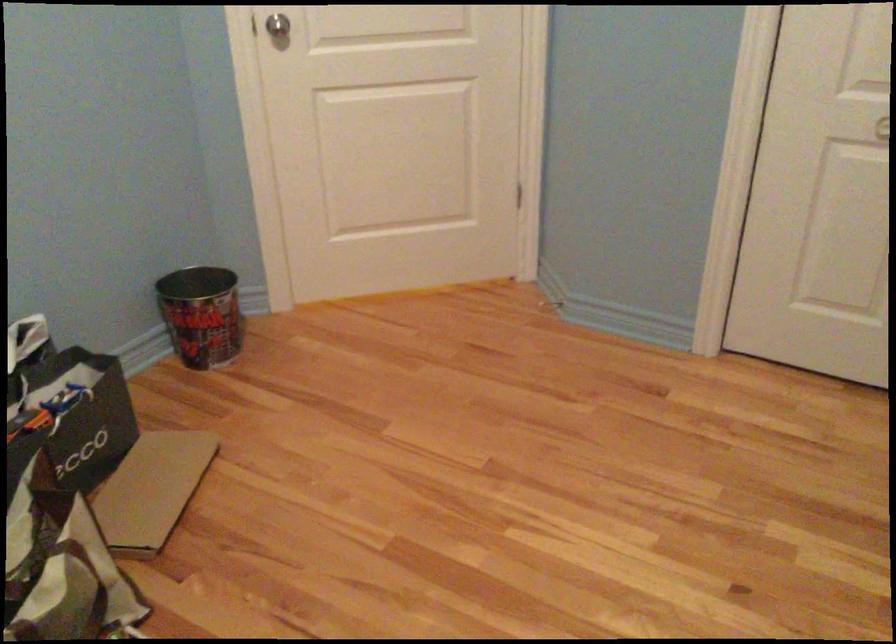
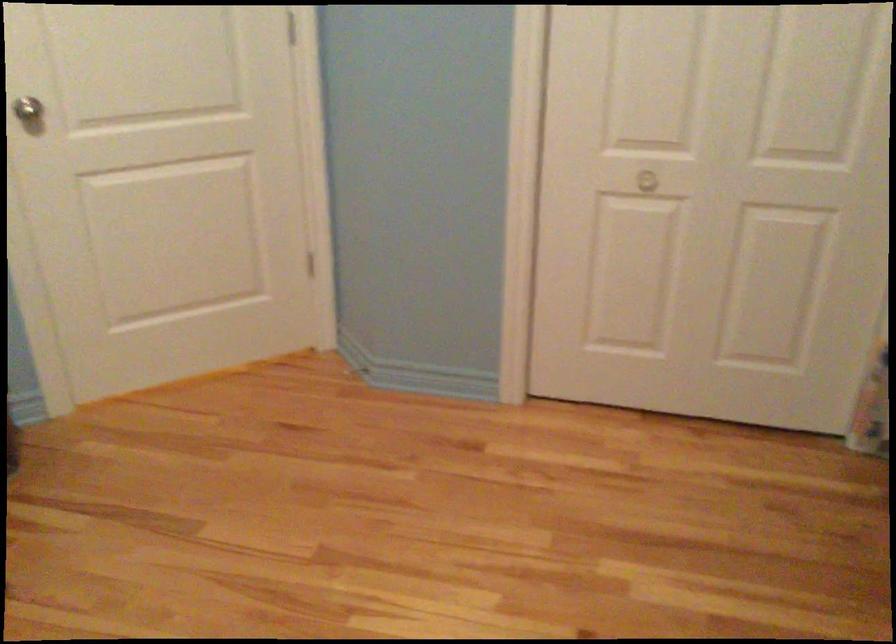
In the scene shown: In a continuous first-person perspective shot, in which direction is the camera moving?

The cameraman moved toward left, forward.